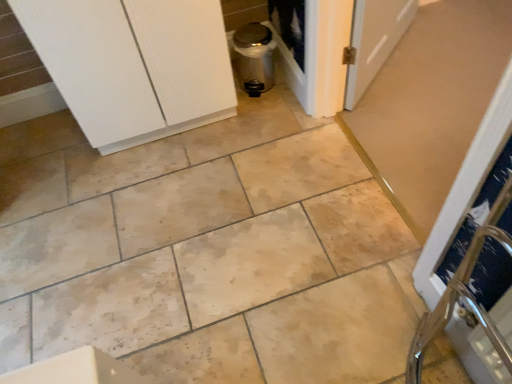
Question: Are satin silver trash can at center and metallic silver screen door at center making contact?

Choices:
 (A) yes
 (B) no

Answer: (B)

Question: Considering the relative positions of satin silver trash can at center and metallic silver screen door at center in the image provided, is satin silver trash can at center to the left of metallic silver screen door at center from the viewer's perspective?

Choices:
 (A) yes
 (B) no

Answer: (A)

Question: From the image's perspective, does satin silver trash can at center appear lower than metallic silver screen door at center?

Choices:
 (A) yes
 (B) no

Answer: (B)

Question: From a real-world perspective, is satin silver trash can at center beneath metallic silver screen door at center?

Choices:
 (A) no
 (B) yes

Answer: (A)

Question: Is satin silver trash can at center smaller than metallic silver screen door at center?

Choices:
 (A) no
 (B) yes

Answer: (A)

Question: Is satin silver trash can at center completely or partially outside of metallic silver screen door at center?

Choices:
 (A) no
 (B) yes

Answer: (B)

Question: Considering the relative sizes of satin silver trash can at center and white textured cabinet at upper left in the image provided, is satin silver trash can at center shorter than white textured cabinet at upper left?

Choices:
 (A) yes
 (B) no

Answer: (A)

Question: Is satin silver trash can at center to the left of white textured cabinet at upper left from the viewer's perspective?

Choices:
 (A) yes
 (B) no

Answer: (B)

Question: From a real-world perspective, is satin silver trash can at center located higher than white textured cabinet at upper left?

Choices:
 (A) no
 (B) yes

Answer: (A)

Question: Is satin silver trash can at center further to camera compared to white textured cabinet at upper left?

Choices:
 (A) no
 (B) yes

Answer: (B)

Question: Is satin silver trash can at center positioned beyond the bounds of white textured cabinet at upper left?

Choices:
 (A) yes
 (B) no

Answer: (A)

Question: Is white textured cabinet at upper left located within satin silver trash can at center?

Choices:
 (A) no
 (B) yes

Answer: (A)

Question: Considering the relative sizes of white textured cabinet at upper left and metallic silver screen door at center in the image provided, is white textured cabinet at upper left bigger than metallic silver screen door at center?

Choices:
 (A) no
 (B) yes

Answer: (B)